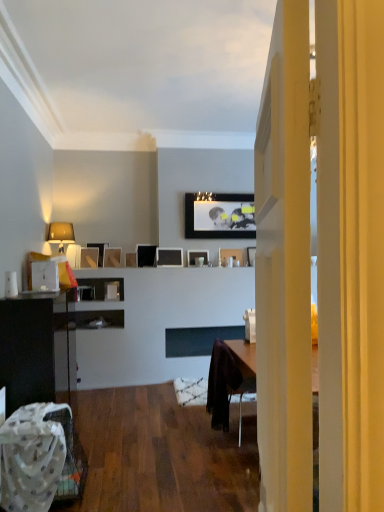
I want to click on free space to the left of velvet dark brown swivel chair at center, so click(188, 434).